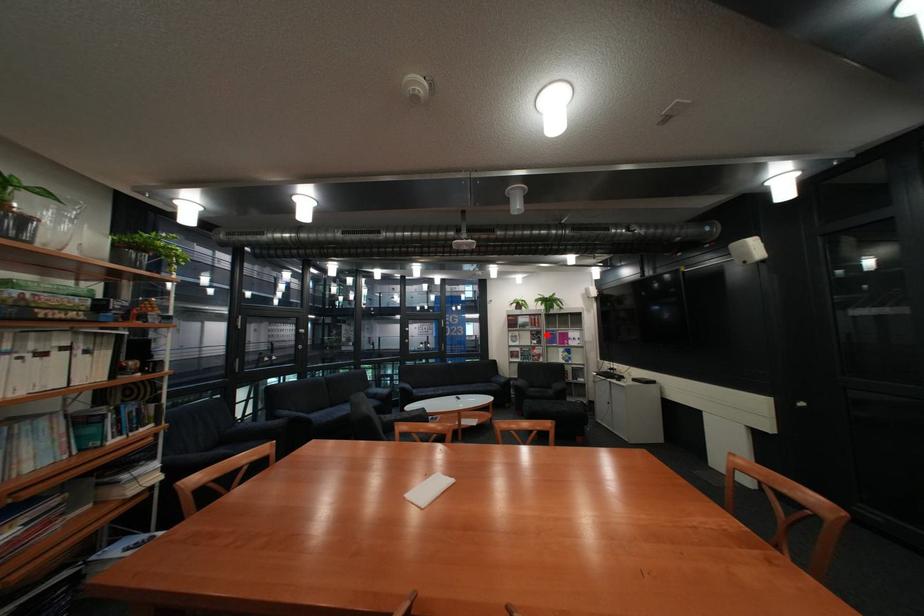
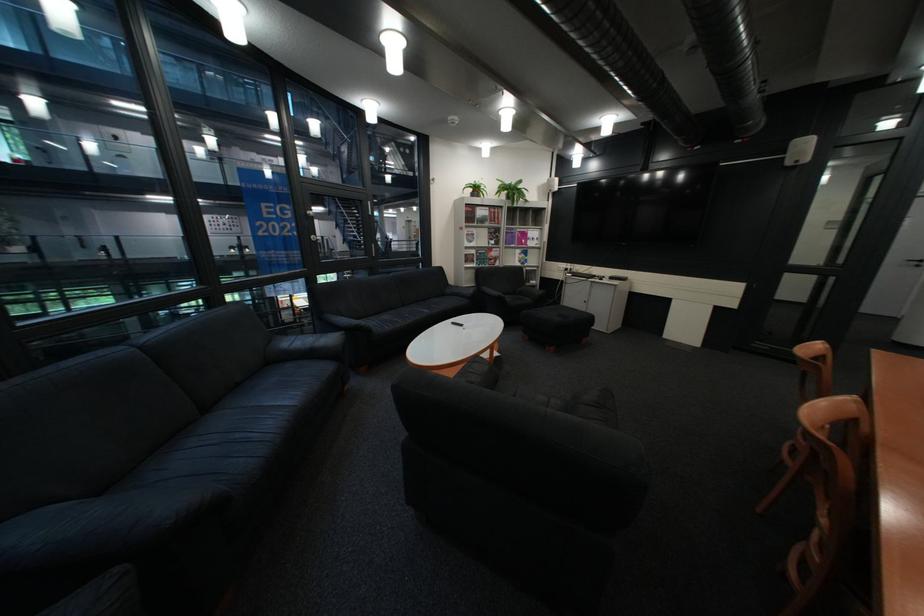
Question: A red point is marked in image1. In image2, is the corresponding 3D point closer to the camera or farther? Reply with the corresponding letter.

Choices:
 (A) The corresponding 3D point is closer.
 (B) The corresponding 3D point is farther.

Answer: (A)